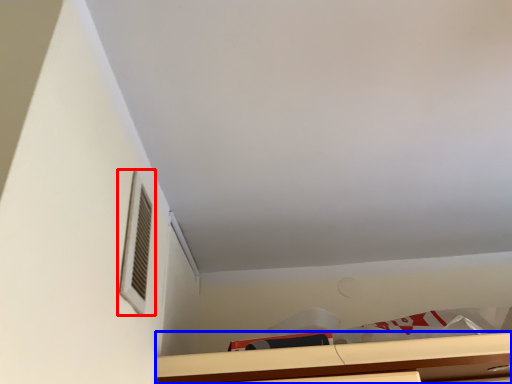
Question: Which object is closer to the camera taking this photo, window (highlighted by a red box) or cabinetry (highlighted by a blue box)?

Choices:
 (A) window
 (B) cabinetry

Answer: (A)